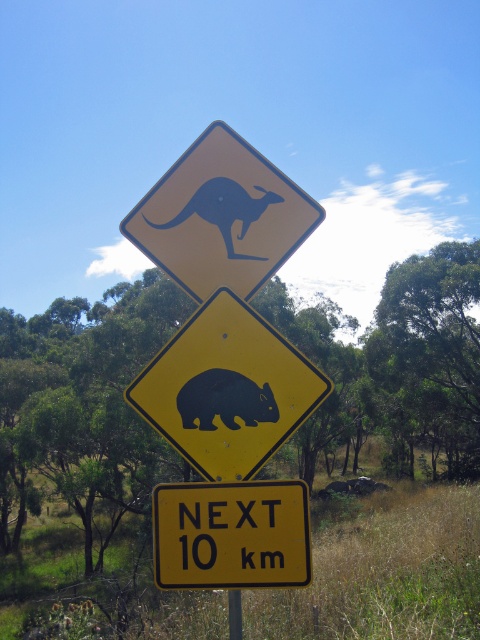
You are driving and see the road sign described in the scene. Which object, the dark blue matte wombat at center or the yellow plastic pole at center, is shorter in height?

The dark blue matte wombat at center has a lesser height compared to the yellow plastic pole at center, so the dark blue matte wombat at center is shorter.